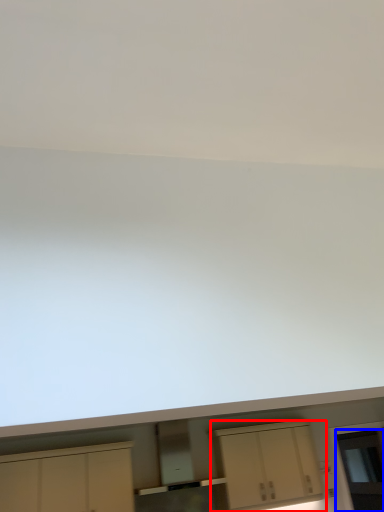
Question: Which object is closer to the camera taking this photo, cabinetry (highlighted by a red box) or glass door (highlighted by a blue box)?

Choices:
 (A) cabinetry
 (B) glass door

Answer: (A)